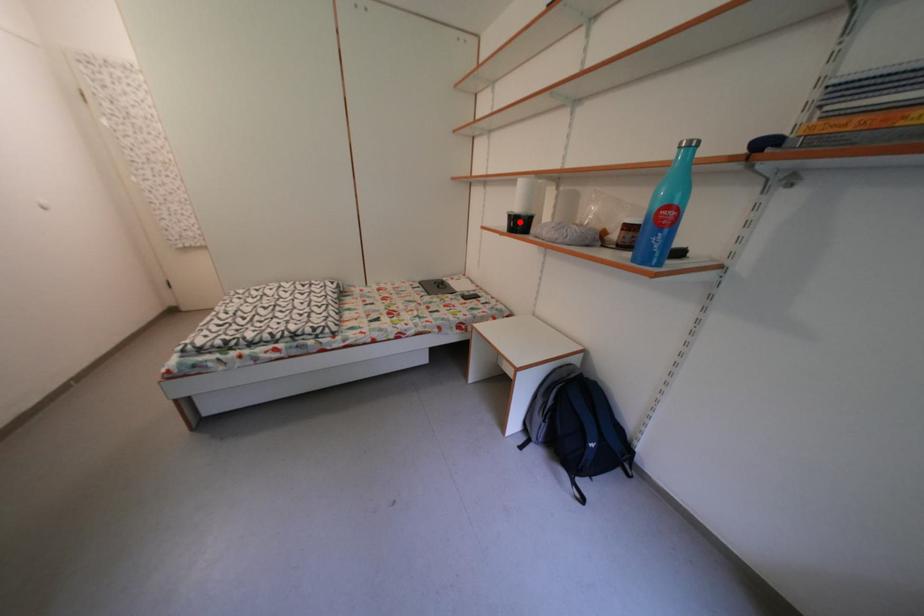
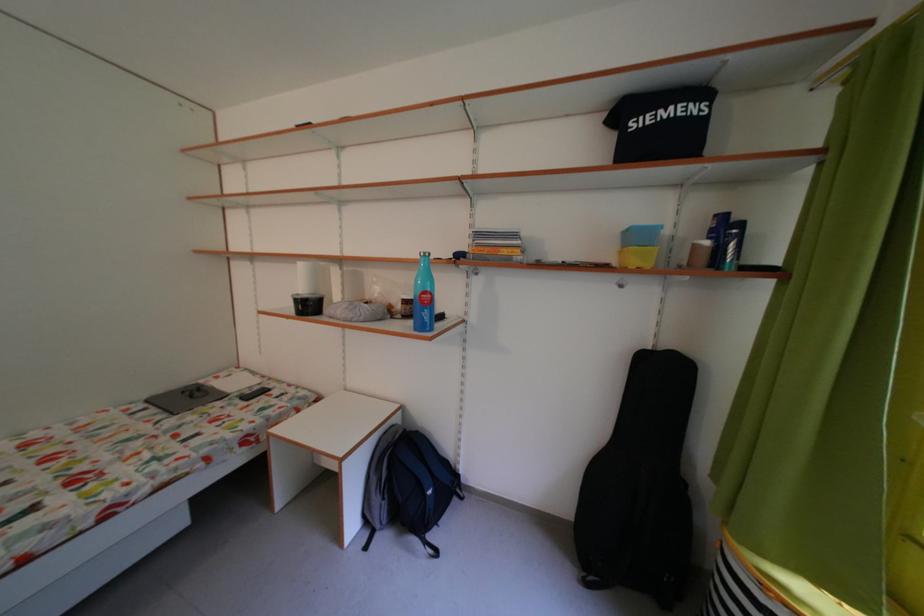
Find the pixel in the second image that matches the highlighted location in the first image.

(306, 306)